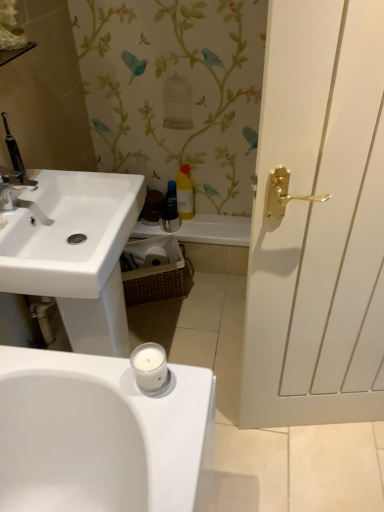
The width and height of the screenshot is (384, 512). Find the location of `free space above white glossy bath at center (from a real-world perspective)`. free space above white glossy bath at center (from a real-world perspective) is located at coordinates (208, 221).